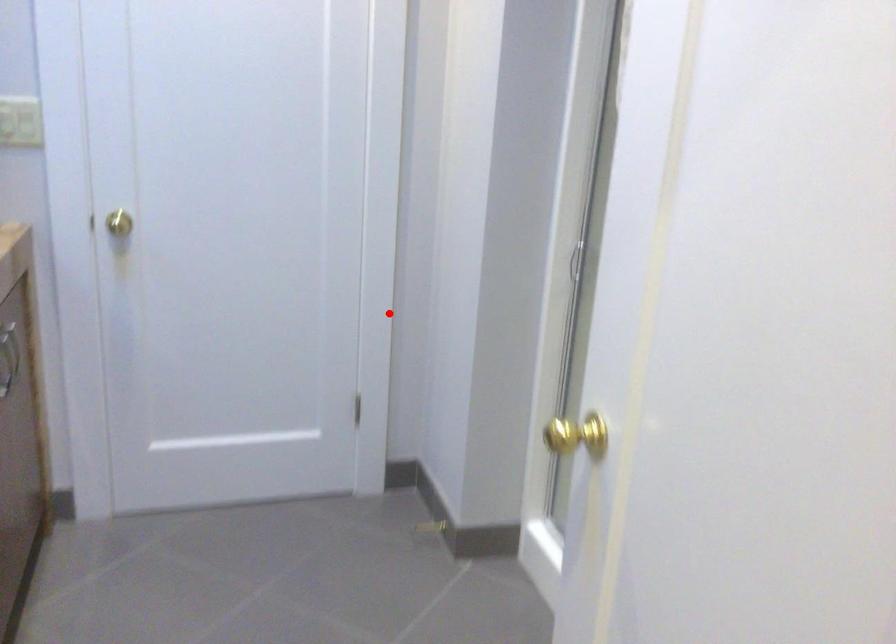
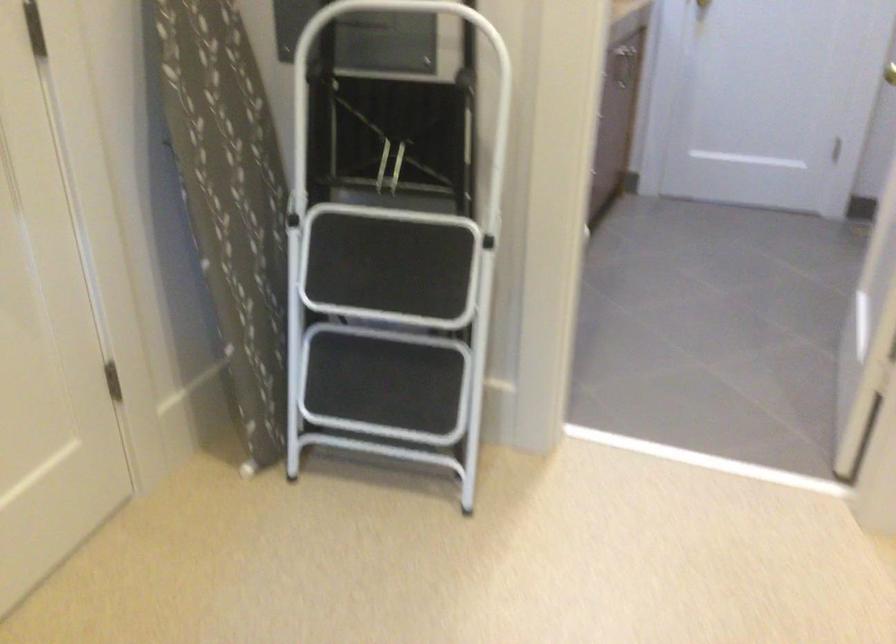
Question: A red point is marked in image1. In image2, is the corresponding 3D point closer to the camera or farther? Reply with the corresponding letter.

Choices:
 (A) The corresponding 3D point is closer.
 (B) The corresponding 3D point is farther.

Answer: (B)